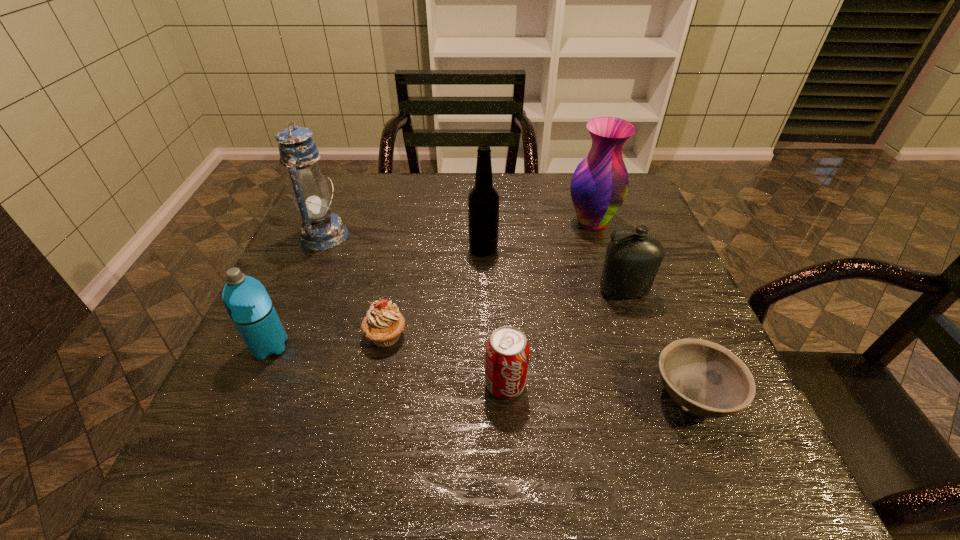
The image size is (960, 540). Identify the location of vase at the right edge. (599, 185).

Locate an element on the screen. The height and width of the screenshot is (540, 960). bottle that is positioned at the right edge is located at coordinates (632, 261).

Locate an element on the screen. Image resolution: width=960 pixels, height=540 pixels. bowl situated at the right edge is located at coordinates (704, 378).

Where is `object located at the far right corner`? object located at the far right corner is located at coordinates (599, 185).

Find the location of `vacant area at the far edge`. vacant area at the far edge is located at coordinates (559, 195).

In the image, there is a desktop. Where is `vacant space at the near edge`? Image resolution: width=960 pixels, height=540 pixels. vacant space at the near edge is located at coordinates (353, 474).

The image size is (960, 540). What are the coordinates of `free region at the left edge of the desktop` in the screenshot? It's located at (278, 360).

You are a GUI agent. You are given a task and a screenshot of the screen. Output one action in this format:
    pyautogui.click(x=<x>, y=<y>)
    Task: Click on the free space at the right edge of the desktop
    The width and height of the screenshot is (960, 540).
    Given the screenshot: What is the action you would take?
    pyautogui.click(x=665, y=285)

The height and width of the screenshot is (540, 960). Find the location of `vacant area at the far left corner`. vacant area at the far left corner is located at coordinates (367, 194).

The height and width of the screenshot is (540, 960). Find the location of `free spot at the near left corner of the desktop`. free spot at the near left corner of the desktop is located at coordinates (274, 472).